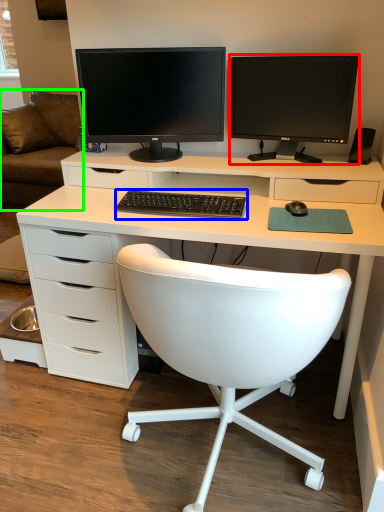
Question: Which object is positioned farthest from computer monitor (highlighted by a red box)? Select from computer keyboard (highlighted by a blue box) and couch (highlighted by a green box).

Choices:
 (A) computer keyboard
 (B) couch

Answer: (B)